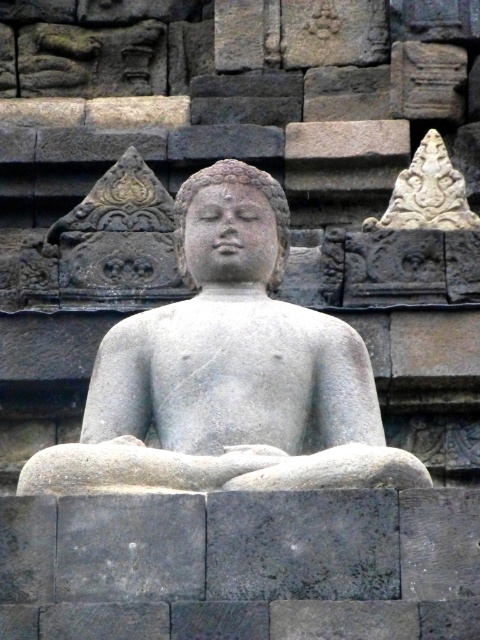
Consider the image. Who is positioned more to the right, gray stone statue at center or carved stone ornament at upper center?

carved stone ornament at upper center is more to the right.

At what (x,y) coordinates should I click in order to perform the action: click on gray stone statue at center. Please return your answer as a coordinate pair (x, y). The width and height of the screenshot is (480, 640). Looking at the image, I should click on (228, 371).

In the scene shown: Who is taller, gray stone statue at center or gray stone head at center?

With more height is gray stone statue at center.

Does gray stone statue at center appear under gray stone head at center?

Indeed, gray stone statue at center is positioned under gray stone head at center.

This screenshot has height=640, width=480. In order to click on gray stone statue at center in this screenshot , I will do coord(228,371).

Between carved stone ornament at upper center and gray stone head at center, which one has more height?

carved stone ornament at upper center

Is carved stone ornament at upper center below gray stone head at center?

Actually, carved stone ornament at upper center is above gray stone head at center.

Identify the location of carved stone ornament at upper center. (428, 193).

The image size is (480, 640). Identify the location of carved stone ornament at upper center. (428, 193).